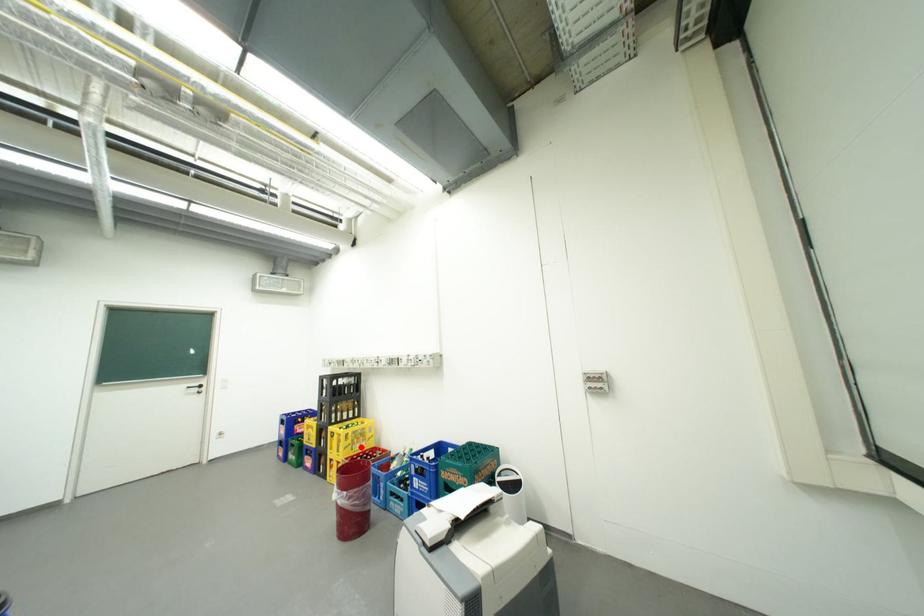
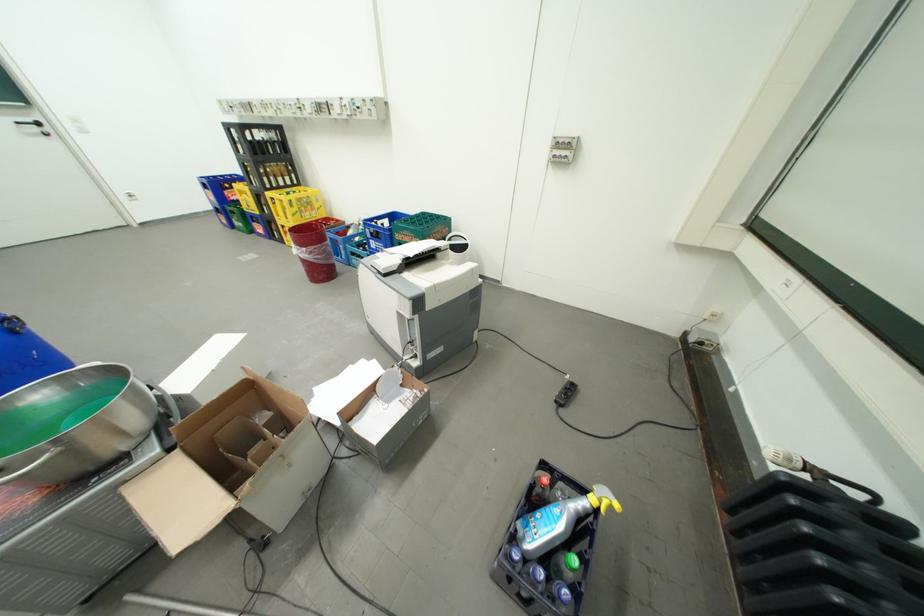
Locate, in the second image, the point that corresponds to the highlighted location in the first image.

(310, 215)